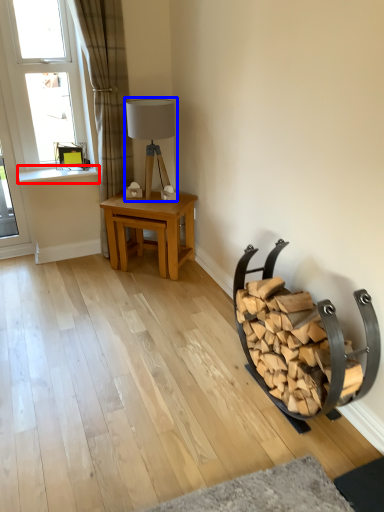
Question: Which object appears closest to the camera in this image, window sill (highlighted by a red box) or table lamp (highlighted by a blue box)?

Choices:
 (A) window sill
 (B) table lamp

Answer: (B)